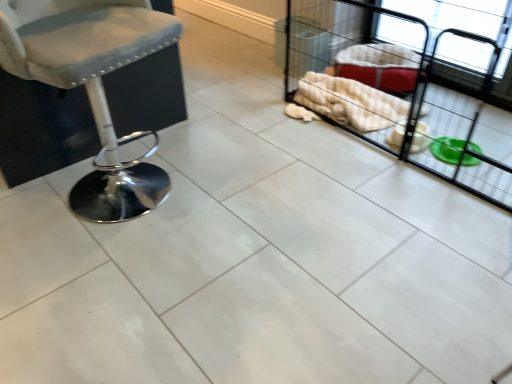
Identify the location of vacant area that lies between matte gray fabric stool at left and white fabric baby carriage at right. (280, 190).